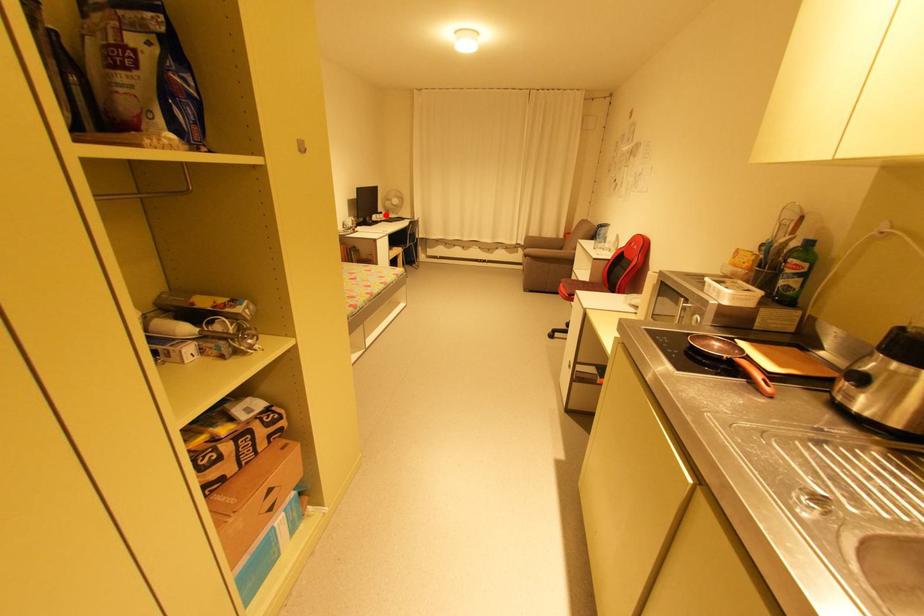
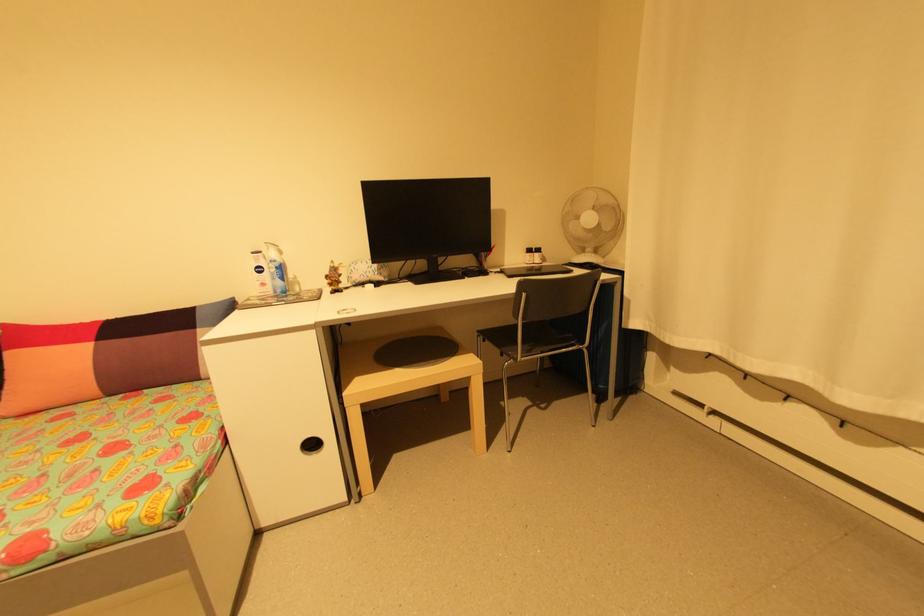
Question: I am providing you with two images of the same scene from different viewpoints. A red point is marked on the first image. At the location where the point appears in image 1, is it still visible in image 2?

Choices:
 (A) Yes
 (B) No

Answer: (A)